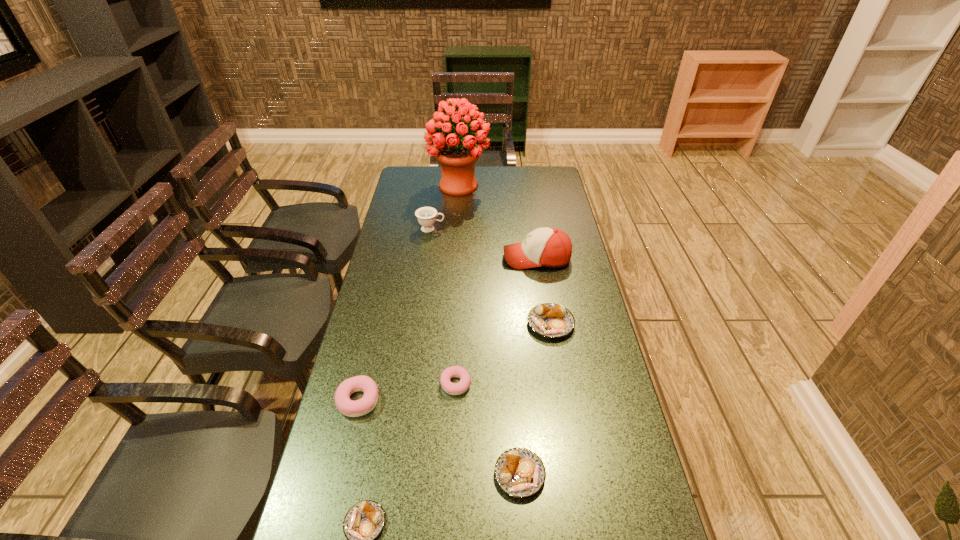
This screenshot has width=960, height=540. I want to click on free area in between the bouquet and the second nearest object, so click(490, 330).

The image size is (960, 540). What are the coordinates of `vacant area that lies between the third pastry from right to left and the teacup` in the screenshot? It's located at (444, 307).

Identify the location of the third closest object to the smallest brown pastry. 462,386.

Where is `object that is the second closest to the tallest object`? Image resolution: width=960 pixels, height=540 pixels. object that is the second closest to the tallest object is located at coordinates (549, 247).

Identify the location of the second closest pastry relative to the teacup. (462, 386).

Find the location of `the fourth closest pastry to the farthest object`. the fourth closest pastry to the farthest object is located at coordinates (519, 472).

Locate which brown pastry is the closest to the seventh nearest object. Please provide its 2D coordinates. Your answer should be formatted as a tuple, i.e. [(x, y)], where the tuple contains the x and y coordinates of a point satisfying the conditions above.

[(549, 320)]

The height and width of the screenshot is (540, 960). Find the location of `brown pastry that is the second closest to the biggest brown pastry`. brown pastry that is the second closest to the biggest brown pastry is located at coordinates (364, 521).

At what (x,y) coordinates should I click in order to perform the action: click on vacant region that satisfies the following two spatial constraints: 1. on the front side of the smaller pink pastry; 2. on the left side of the farthest object. Please return your answer as a coordinate pair (x, y). The image size is (960, 540). Looking at the image, I should click on (444, 384).

Where is `free space that satisfies the following two spatial constraints: 1. on the front-facing side of the biggest brown pastry; 2. on the left side of the second tallest object`? The height and width of the screenshot is (540, 960). free space that satisfies the following two spatial constraints: 1. on the front-facing side of the biggest brown pastry; 2. on the left side of the second tallest object is located at coordinates 547,324.